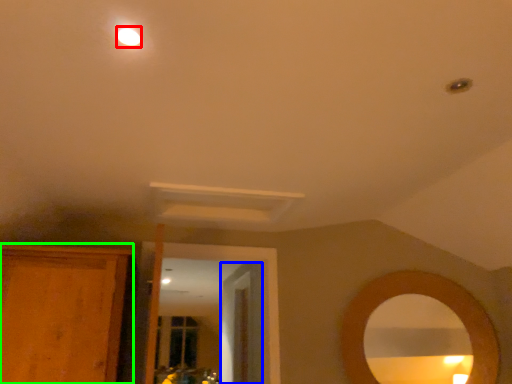
Question: Based on their relative distances, which object is nearer to lighting (highlighted by a red box)? Choose from door (highlighted by a blue box) and cabinetry (highlighted by a green box).

Choices:
 (A) door
 (B) cabinetry

Answer: (B)